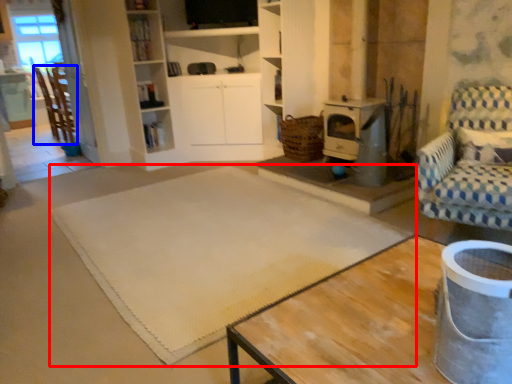
Question: Which object appears closest to the camera in this image, mat (highlighted by a red box) or chair (highlighted by a blue box)?

Choices:
 (A) mat
 (B) chair

Answer: (A)